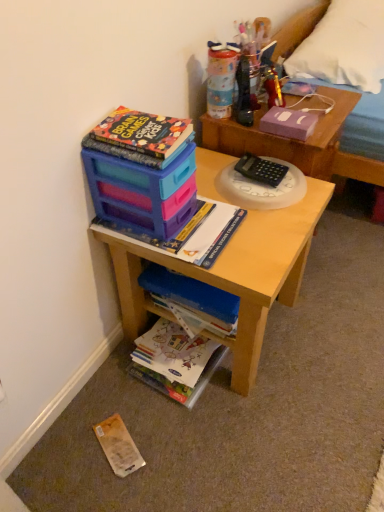
Where is `vacant space that is to the left of colored paper art at lower center, arranged as the 1th book when ordered from the bottom`? The width and height of the screenshot is (384, 512). vacant space that is to the left of colored paper art at lower center, arranged as the 1th book when ordered from the bottom is located at coordinates (100, 387).